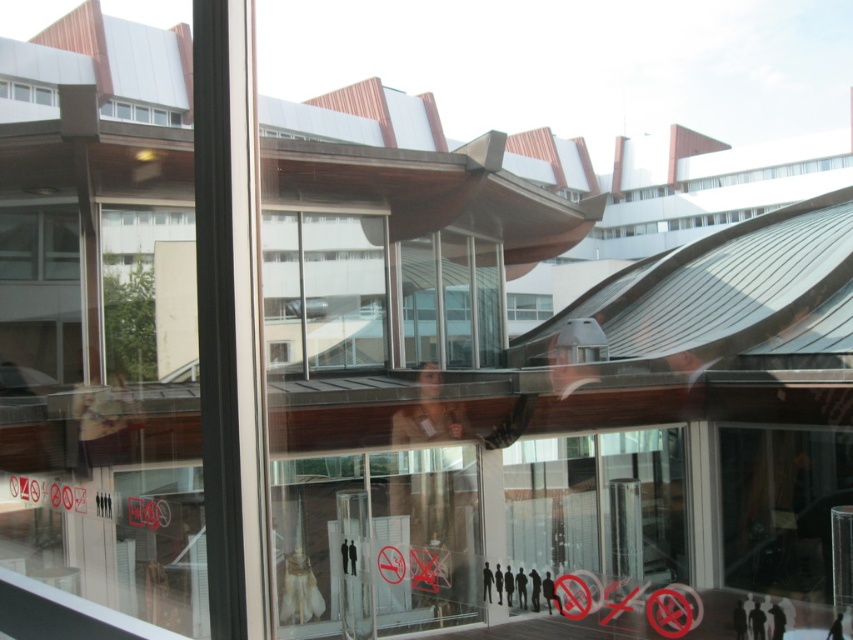
Identify the location of transparent glass door at center. (376, 541).

Is point (294, 588) behind point (157, 113)?

No.

Locate an element on the screen. transparent glass door at center is located at coordinates (376, 541).

Which is above, transparent glass door at center or clear glass window at upper left?

clear glass window at upper left is higher up.

Does transparent glass door at center have a greater height compared to clear glass window at upper left?

Correct, transparent glass door at center is much taller as clear glass window at upper left.

The width and height of the screenshot is (853, 640). What are the coordinates of `transparent glass door at center` in the screenshot? It's located at (376, 541).

Find the location of a particular element. Image resolution: width=853 pixels, height=640 pixels. transparent glass door at center is located at coordinates (376, 541).

Who is shorter, clear glass window at upper center or clear glass window at upper left?

clear glass window at upper left

Between point (128, 106) and point (10, 96), which one is positioned behind?

The point (128, 106) is behind.

In order to click on clear glass window at upper center in this screenshot , I will do `click(138, 113)`.